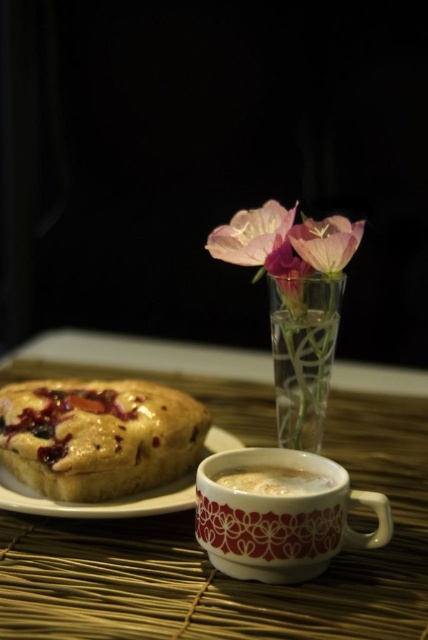
You are looking at the scene on the bamboo mat. There are two points marked in the image, one at coordinate point [157,500] and another at point [238,483]. Which point is closer to you?

Point [157,500] is closer to you because it is further to the viewer than point [238,483].

You are standing in front of the scene described. Where is the wooden table at center located in terms of coordinates?

The wooden table at center is located at coordinates point (229, 579).